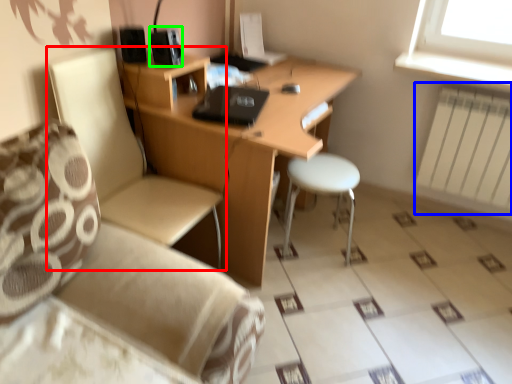
Question: Which is nearer to the chair (highlighted by a red box)? radiator (highlighted by a blue box) or speaker (highlighted by a green box).

Choices:
 (A) radiator
 (B) speaker

Answer: (B)